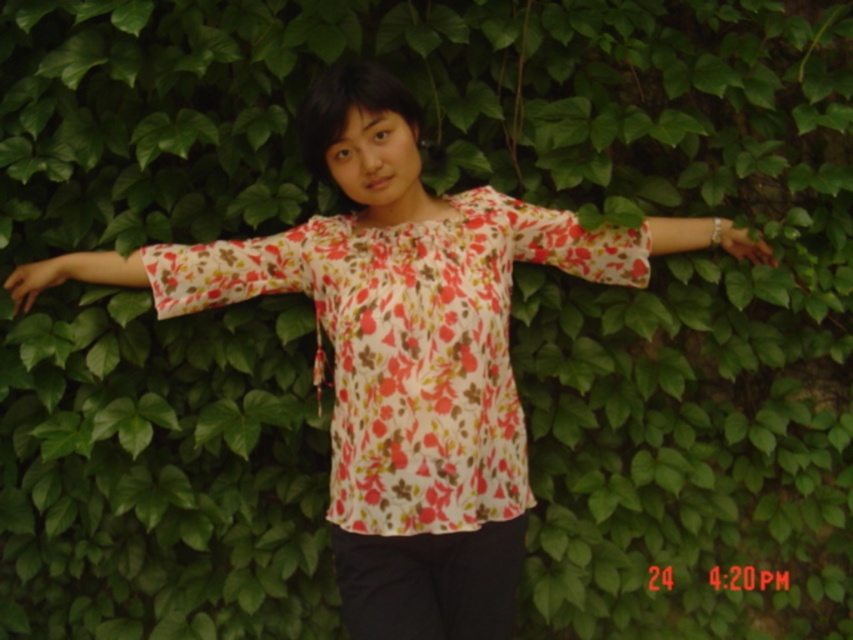
Question: Does floral fabric arm at center appear under matte floral blouse at center?

Choices:
 (A) yes
 (B) no

Answer: (A)

Question: Among these objects, which one is farthest from the camera?

Choices:
 (A) floral fabric arm at center
 (B) floral fabric arm at left
 (C) matte floral blouse at center
 (D) matte floral shirt at left

Answer: (C)

Question: Is floral fabric arm at center to the right of matte floral shirt at left from the viewer's perspective?

Choices:
 (A) no
 (B) yes

Answer: (B)

Question: Among these objects, which one is nearest to the camera?

Choices:
 (A) matte floral shirt at left
 (B) floral fabric arm at center
 (C) matte floral blouse at center

Answer: (B)

Question: Does floral fabric arm at left have a lesser width compared to matte floral blouse at center?

Choices:
 (A) no
 (B) yes

Answer: (A)

Question: Which point is farther to the camera?

Choices:
 (A) floral fabric arm at left
 (B) matte floral shirt at left
 (C) floral fabric arm at center
 (D) matte floral blouse at center

Answer: (D)